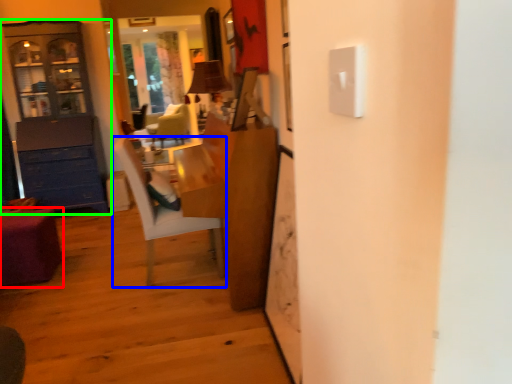
Question: Which object is positioned farthest from desk (highlighted by a red box)? Select from chair (highlighted by a blue box) and cabinetry (highlighted by a green box).

Choices:
 (A) chair
 (B) cabinetry

Answer: (B)